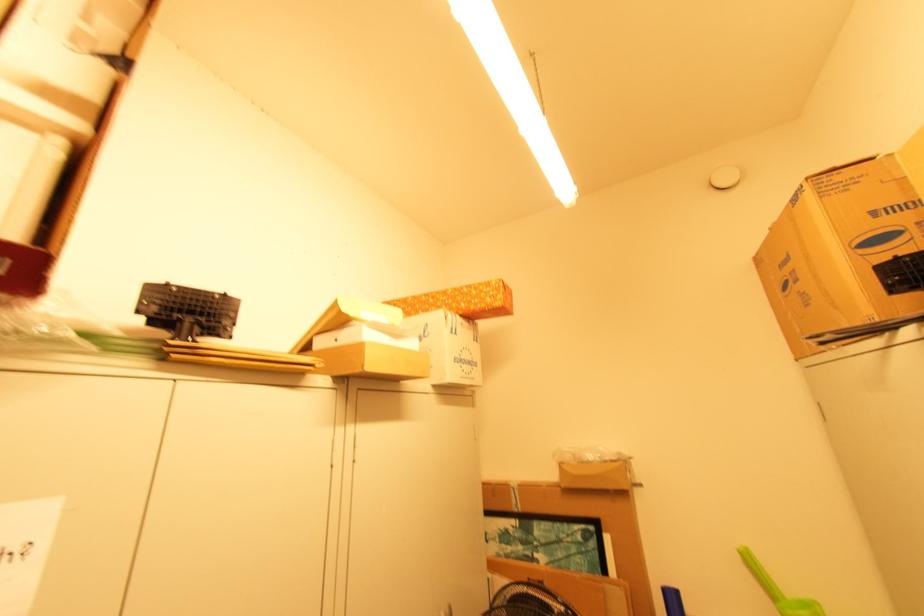
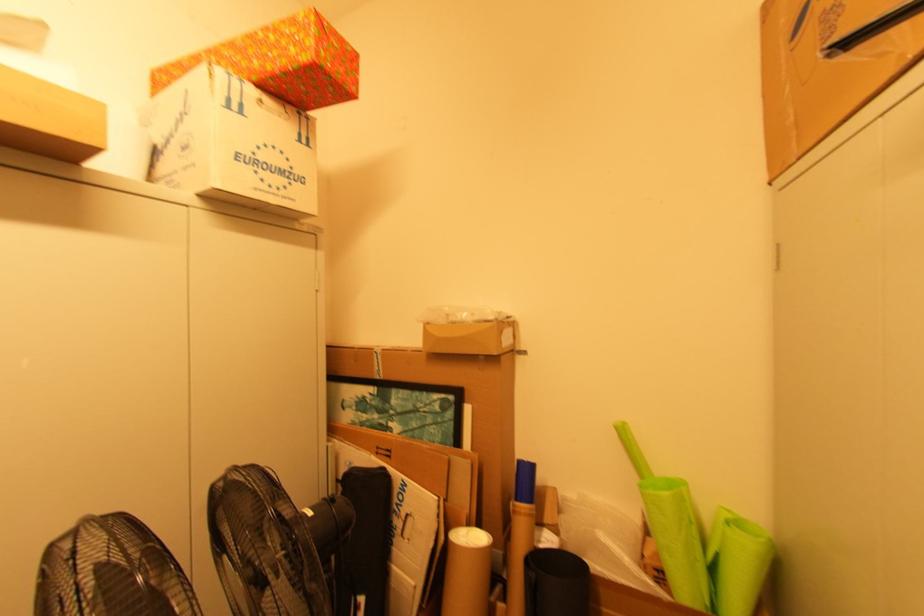
Where in the second image is the point corresponding to the point at 465,304 from the first image?

(258, 63)